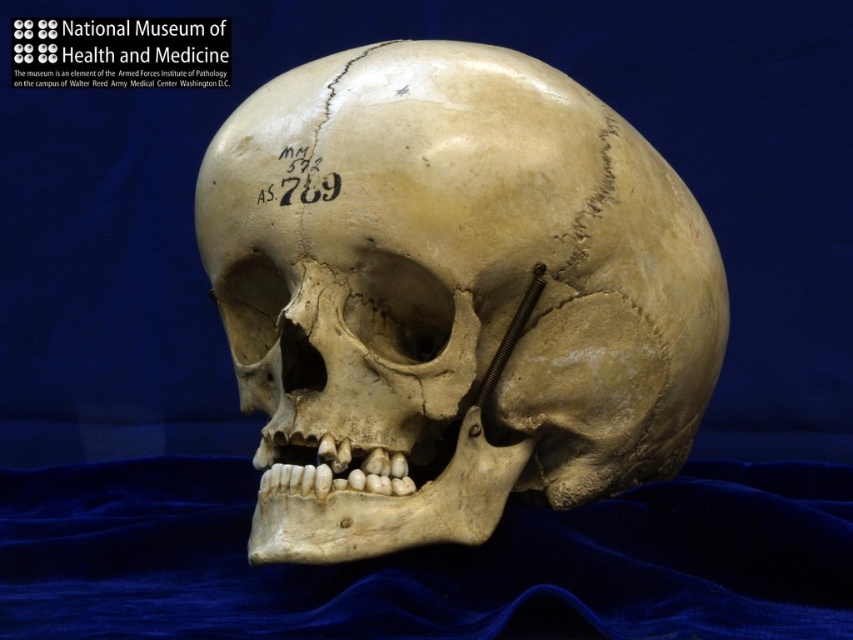
Question: Among these objects, which one is farthest from the camera?

Choices:
 (A) velvet blue cloth at lower center
 (B) matte bone skull at center
 (C) black ink label at center
 (D) white paper text at upper left

Answer: (D)

Question: Is velvet blue cloth at lower center in front of black ink label at center?

Choices:
 (A) no
 (B) yes

Answer: (B)

Question: Can you confirm if matte bone skull at center is positioned to the left of white paper text at upper left?

Choices:
 (A) no
 (B) yes

Answer: (A)

Question: Is matte bone skull at center below velvet blue cloth at lower center?

Choices:
 (A) yes
 (B) no

Answer: (B)

Question: Which object is positioned farthest from the velvet blue cloth at lower center?

Choices:
 (A) black ink label at center
 (B) white paper text at upper left
 (C) matte bone skull at center

Answer: (B)

Question: Which point is closer to the camera?

Choices:
 (A) (386, 147)
 (B) (161, 38)

Answer: (A)